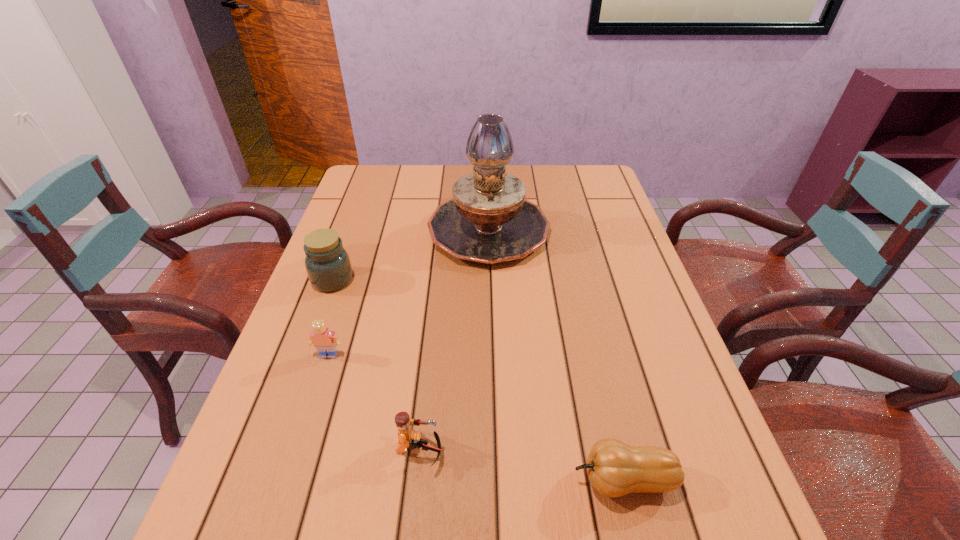
Identify the location of vacant space located 0.380m on the stem side of the gourd. tap(354, 480).

Find the location of a particular element. blank space located on the stem side of the gourd is located at coordinates (452, 480).

Locate an element on the screen. This screenshot has width=960, height=540. vacant space located 0.280m on the stem side of the gourd is located at coordinates point(412,480).

At what (x,y) coordinates should I click in order to perform the action: click on object at the far edge. Please return your answer as a coordinate pair (x, y). The width and height of the screenshot is (960, 540). Looking at the image, I should click on 488,220.

Identify the location of jar that is at the left edge. The image size is (960, 540). (327, 263).

Locate an element on the screen. The height and width of the screenshot is (540, 960). Lego situated at the left edge is located at coordinates (322, 338).

I want to click on object positioned at the right edge, so click(614, 468).

Find the location of a particular element. free location at the far edge is located at coordinates (450, 182).

Where is `vacant space at the left edge of the desktop`? The height and width of the screenshot is (540, 960). vacant space at the left edge of the desktop is located at coordinates (316, 426).

What are the coordinates of `free space at the right edge of the desktop` in the screenshot? It's located at (662, 399).